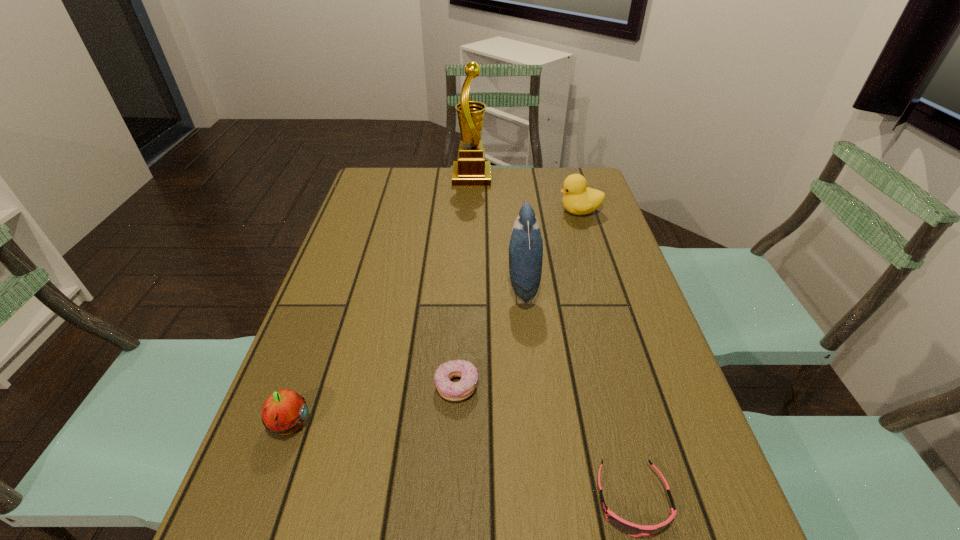
Find the location of a particular element. The height and width of the screenshot is (540, 960). vacant area situated at the tip of the bird's beak is located at coordinates (352, 286).

Identify the location of vacant space situated at the tip of the bird's beak. (380, 286).

The image size is (960, 540). In order to click on vacant position located at the tip of the bird's beak in this screenshot , I will do `click(408, 286)`.

The width and height of the screenshot is (960, 540). Identify the location of blank area located 0.210m on the front-facing side of the second farthest object. (491, 211).

This screenshot has width=960, height=540. Identify the location of vacant space located on the front-facing side of the second farthest object. (468, 211).

Where is `free region located 0.090m on the front-facing side of the second farthest object`? free region located 0.090m on the front-facing side of the second farthest object is located at coordinates (529, 211).

Find the location of a particular element. This screenshot has width=960, height=540. free location located on the right of the third shortest object is located at coordinates (492, 424).

You are a GUI agent. You are given a task and a screenshot of the screen. Output one action in this format:
    pyautogui.click(x=<x>, y=<y>)
    Task: Click on the free spot located on the right of the third nearest object
    This screenshot has width=960, height=540.
    Given the screenshot: What is the action you would take?
    [578, 386]

The image size is (960, 540). Find the location of `award present at the far edge`. award present at the far edge is located at coordinates (471, 170).

This screenshot has width=960, height=540. Find the location of `duck positioned at the far edge`. duck positioned at the far edge is located at coordinates tap(579, 199).